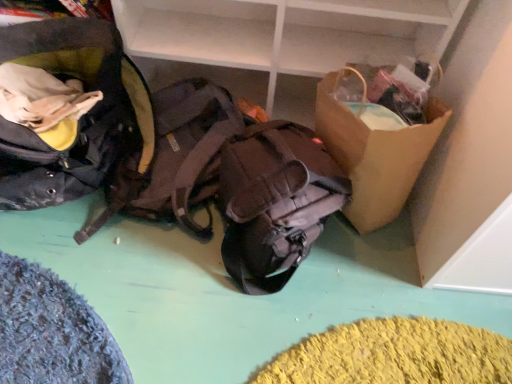
Question: Does point (112, 198) appear closer or farther from the camera than point (108, 86)?

Choices:
 (A) closer
 (B) farther

Answer: (B)

Question: Is brown fabric backpack at center, positioned as the 2th backpack in right-to-left order, bigger or smaller than matte black backpack at left, positioned as the 3th backpack in right-to-left order?

Choices:
 (A) big
 (B) small

Answer: (B)

Question: Which is farther from the brown fabric backpack at center, which is the 2th backpack in left-to-right order?

Choices:
 (A) matte black backpack at left, positioned as the 3th backpack in right-to-left order
 (B) brown cardboard box at upper right
 (C) brown paper bag at right
 (D) matte brown backpack at center, the third backpack in the left-to-right sequence

Answer: (C)

Question: Which is farther from the brown paper bag at right?

Choices:
 (A) matte brown backpack at center, the third backpack in the left-to-right sequence
 (B) matte black backpack at left, placed as the first backpack when sorted from left to right
 (C) brown cardboard box at upper right
 (D) brown fabric backpack at center, which is the 2th backpack in left-to-right order

Answer: (B)